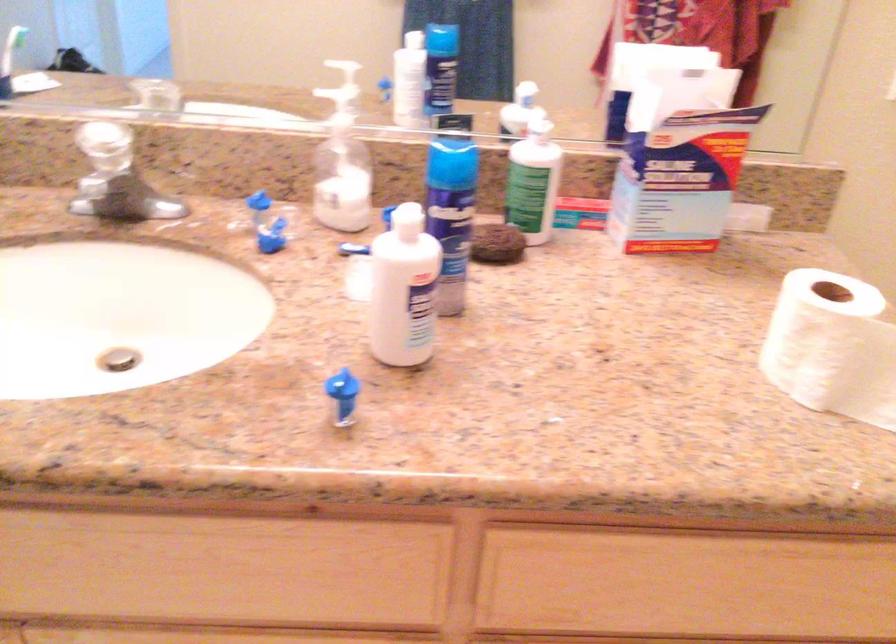
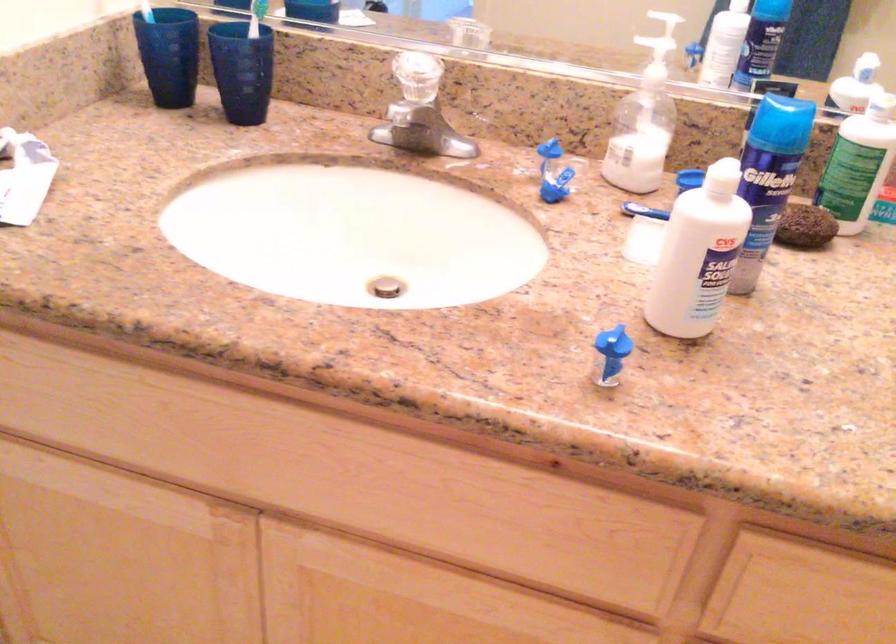
Question: The camera is either moving clockwise (left) or counter-clockwise (right) around the object. The first image is from the beginning of the video and the second image is from the end. Is the camera moving left or right when shooting the video?

Choices:
 (A) Left
 (B) Right

Answer: (B)